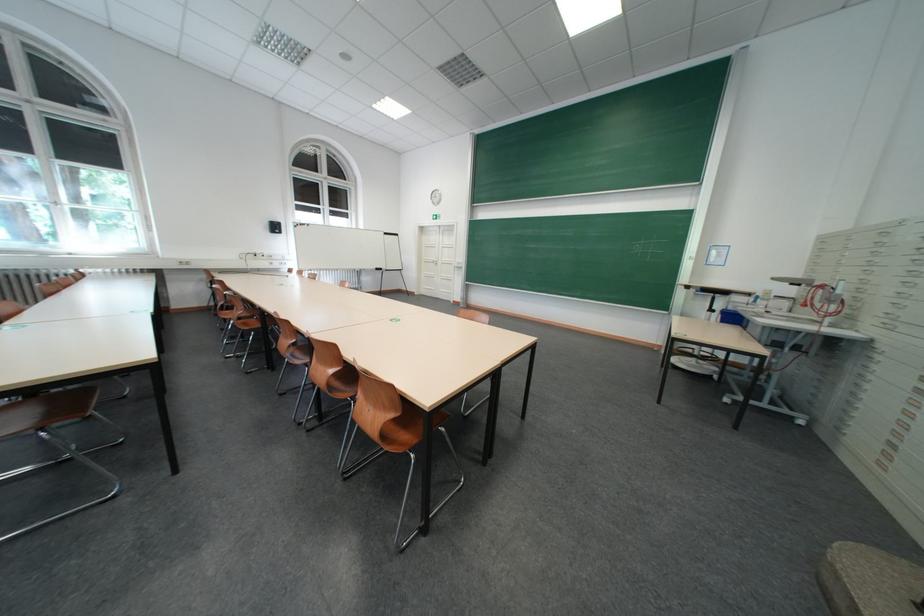
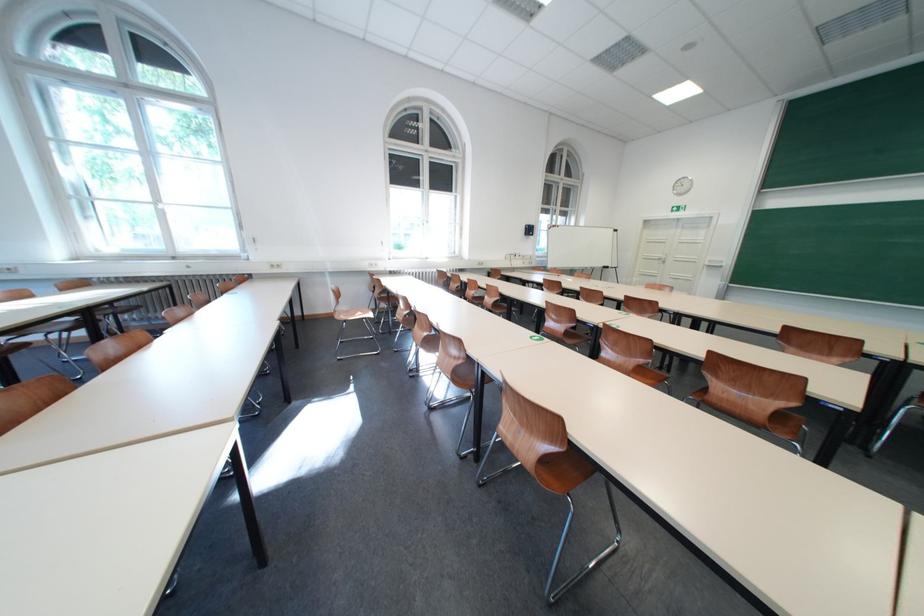
Question: In a continuous first-person perspective shot, in which direction is the camera moving?

Choices:
 (A) Left
 (B) Right
 (C) Forward
 (D) Backward

Answer: (A)